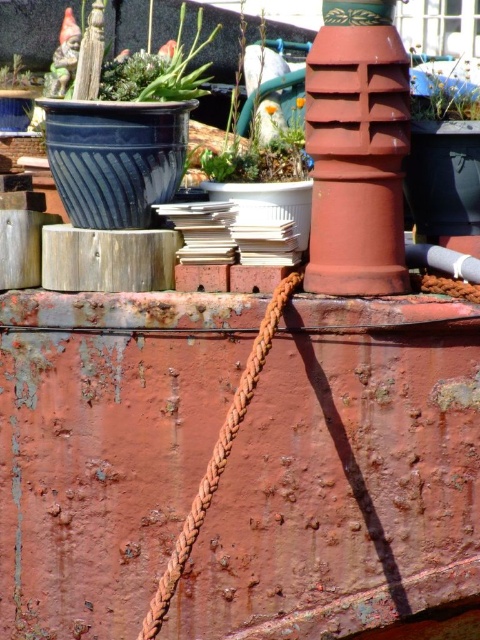
Question: Does green matte plant at upper center have a lesser width compared to brown braided rope at center?

Choices:
 (A) yes
 (B) no

Answer: (A)

Question: Which object is the closest to the green leafy plant at upper right?

Choices:
 (A) brown braided rope at center
 (B) green matte plant at upper center

Answer: (B)

Question: Can you confirm if brown braided rope at center is positioned above green matte succulent at upper left?

Choices:
 (A) yes
 (B) no

Answer: (B)

Question: Which of the following is the farthest from the observer?

Choices:
 (A) (283, 150)
 (B) (254, 380)

Answer: (A)

Question: Which is nearer to the green matte succulent at upper left?

Choices:
 (A) brown braided rope at center
 (B) green leafy plant at upper right
 (C) green matte plant at upper center

Answer: (C)

Question: Where is brown braided rope at center located in relation to green leafy plant at upper right in the image?

Choices:
 (A) above
 (B) below

Answer: (B)